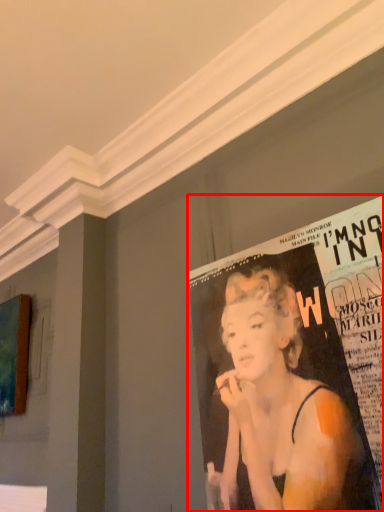
Question: From the image's perspective, considering the relative positions of poster (annotated by the red box) and advertisement in the image provided, where is poster (annotated by the red box) located with respect to the staircase?

Choices:
 (A) above
 (B) below

Answer: (A)